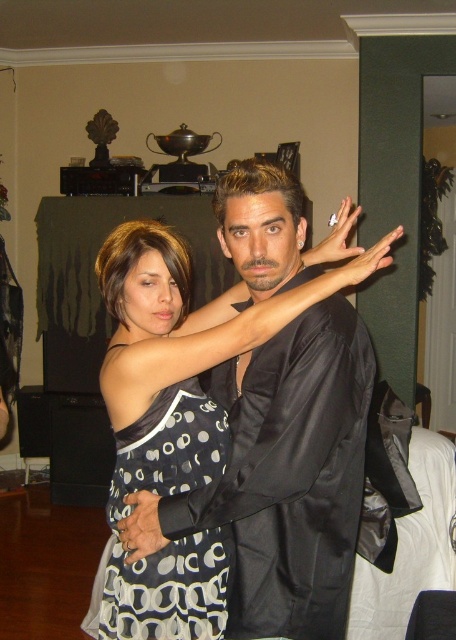
You are a photographer setting up a shoot in a living room. You have two dresses displayed at the center of the room. The black satin dress at center and the black dotted fabric dress at center. Since you want to ensure proper lighting, which dress should you focus your spotlight on to avoid shadows from the other dress?

The black satin dress at center is much taller than the black dotted fabric dress at center. Therefore, you should focus the spotlight on the black satin dress at center to avoid its shadow falling on the shorter dress.

You are a photographer setting up a shoot in this room. You need to place a 1.2 meter wide backdrop behind the two dresses. Will the backdrop be wide enough to cover both the black satin dress at center and the black dotted fabric dress at center without any overlap?

The black satin dress at center is wider than the black dotted fabric dress at center. Since the backdrop is 1.2 meters wide, it can accommodate both dresses as long as their combined width does not exceed 1.2 meters. However, without knowing the exact widths, it is impossible to determine if the backdrop will be sufficient.

You are a photographer standing at the camera position. You want to take a closeup shot of the black satin dress at center. Can you estimate if the dress is within the standard 5 feet focus range of most cameras?

The black satin dress at center is 4.34 feet from camera, which is within the standard 5 feet focus range of most cameras, so yes.